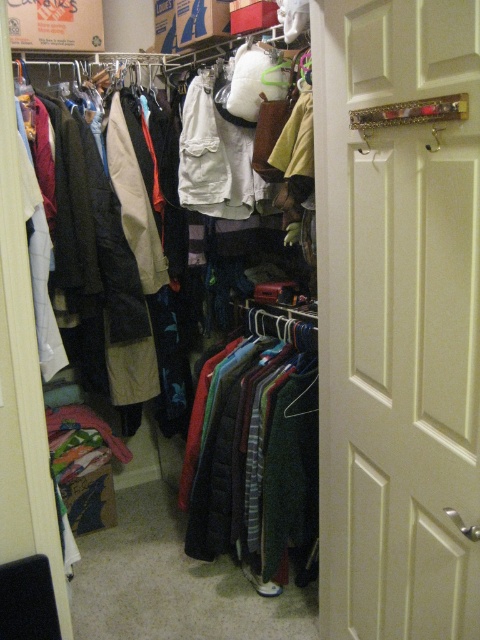
You are trying to decide whether to hang a new long coat in the closet. You see the white wood door at center and the dark green wool sweater at center. Which object is taller and can accommodate the coat?

The white wood door at center is much taller than the dark green wool sweater at center, so the white wood door at center can accommodate the coat.